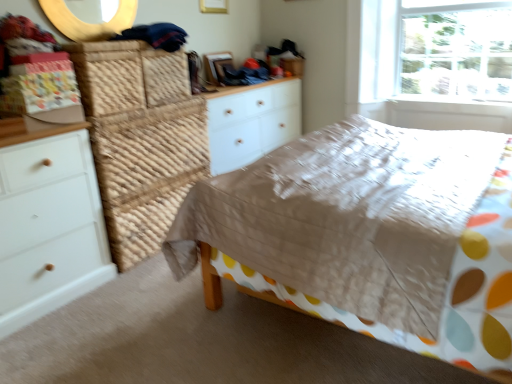
The height and width of the screenshot is (384, 512). What do you see at coordinates (371, 234) in the screenshot?
I see `matte brown bed at center` at bounding box center [371, 234].

The height and width of the screenshot is (384, 512). Identify the location of transparent glass window at upper right. (436, 49).

The width and height of the screenshot is (512, 384). I want to click on white wood chest of drawers at center, which ranks as the first chest of drawers in back-to-front order, so coord(252,123).

In order to click on matte brown bed at center in this screenshot , I will do `click(371, 234)`.

Consider the image. Is matte brown bed at center far from transparent glass window at upper right?

Absolutely, matte brown bed at center is distant from transparent glass window at upper right.

How different are the orientations of matte brown bed at center and transparent glass window at upper right in degrees?

matte brown bed at center and transparent glass window at upper right are facing 87.6 degrees away from each other.

Which object is more forward, matte brown bed at center or transparent glass window at upper right?

Positioned in front is matte brown bed at center.

Where is `bed on the left of transparent glass window at upper right`? The image size is (512, 384). bed on the left of transparent glass window at upper right is located at coordinates (371, 234).

How distant is white wood chest of drawers at left, which ranks as the first chest of drawers in front-to-back order, from matte brown bed at center?

They are 3.58 feet apart.

Is matte brown bed at center surrounded by white wood chest of drawers at left, the 1th chest of drawers positioned from the left?

That's incorrect, matte brown bed at center is not inside white wood chest of drawers at left, the 1th chest of drawers positioned from the left.

In terms of size, does white wood chest of drawers at left, arranged as the 2th chest of drawers when viewed from the right, appear bigger or smaller than matte brown bed at center?

white wood chest of drawers at left, arranged as the 2th chest of drawers when viewed from the right, is smaller than matte brown bed at center.

Is white wood chest of drawers at left, arranged as the 2th chest of drawers when viewed from the right, with matte brown bed at center?

No.

Between point (375, 58) and point (101, 26), which one is positioned behind?

The point (375, 58) is farther from the camera.

Who is shorter, transparent glass window at upper right or wooden round mirror at upper center?

With less height is wooden round mirror at upper center.

How far apart are transparent glass window at upper right and wooden round mirror at upper center?

transparent glass window at upper right is 2.25 meters from wooden round mirror at upper center.

Which object is thinner, transparent glass window at upper right or wooden round mirror at upper center?

wooden round mirror at upper center.

In the scene shown: Is transparent glass window at upper right behind white wood chest of drawers at center, which ranks as the first chest of drawers in back-to-front order?

That is True.

From a real-world perspective, is transparent glass window at upper right beneath white wood chest of drawers at center, the second chest of drawers positioned from the front?

Actually, transparent glass window at upper right is physically above white wood chest of drawers at center, the second chest of drawers positioned from the front, in the real world.

Would you say transparent glass window at upper right is to the left or to the right of white wood chest of drawers at center, the 2th chest of drawers from the left, in the picture?

Clearly, transparent glass window at upper right is on the right of white wood chest of drawers at center, the 2th chest of drawers from the left, in the image.

Is transparent glass window at upper right in contact with white wood chest of drawers at center, arranged as the 1th chest of drawers when viewed from the right?

No, transparent glass window at upper right is not making contact with white wood chest of drawers at center, arranged as the 1th chest of drawers when viewed from the right.

Does transparent glass window at upper right have a lesser height compared to matte brown bed at center?

No.

What's the angular difference between transparent glass window at upper right and matte brown bed at center's facing directions?

The angle between the facing direction of transparent glass window at upper right and the facing direction of matte brown bed at center is 87.6 degrees.

Between transparent glass window at upper right and matte brown bed at center, which one has larger width?

Wider between the two is matte brown bed at center.

From the picture: Measure the distance from wooden round mirror at upper center to white wood chest of drawers at left, arranged as the 2th chest of drawers when viewed from the right.

A distance of 3.40 feet exists between wooden round mirror at upper center and white wood chest of drawers at left, arranged as the 2th chest of drawers when viewed from the right.

Considering the positions of objects wooden round mirror at upper center and white wood chest of drawers at left, arranged as the 2th chest of drawers when viewed from the right, in the image provided, who is more to the right, wooden round mirror at upper center or white wood chest of drawers at left, arranged as the 2th chest of drawers when viewed from the right,?

From the viewer's perspective, wooden round mirror at upper center appears more on the right side.

Which of these two, wooden round mirror at upper center or white wood chest of drawers at left, the 1th chest of drawers positioned from the left, is bigger?

white wood chest of drawers at left, the 1th chest of drawers positioned from the left, is bigger.

Is point (44, 7) behind point (31, 215)?

Yes.

Is wooden round mirror at upper center not near transparent glass window at upper right?

Absolutely, wooden round mirror at upper center is distant from transparent glass window at upper right.

How many degrees apart are the facing directions of wooden round mirror at upper center and transparent glass window at upper right?

The facing directions of wooden round mirror at upper center and transparent glass window at upper right are 91.2 degrees apart.

Is wooden round mirror at upper center at the left side of transparent glass window at upper right?

Yes.

Can you confirm if wooden round mirror at upper center is wider than transparent glass window at upper right?

No.

Locate an element on the screen. Image resolution: width=512 pixels, height=384 pixels. bed that is in front of the transparent glass window at upper right is located at coordinates (371, 234).

In order to click on the chest of drawers located underneath the matte brown bed at center (from a real-world perspective) in this screenshot , I will do `click(49, 224)`.

Consider the image. Looking at the image, which one is located further to wooden round mirror at upper center, white wood chest of drawers at left, which ranks as the first chest of drawers in front-to-back order, or transparent glass window at upper right?

transparent glass window at upper right is further to wooden round mirror at upper center.

Based on their spatial positions, is transparent glass window at upper right or wooden round mirror at upper center closer to matte brown bed at center?

transparent glass window at upper right is positioned closer to the anchor matte brown bed at center.

Estimate the real-world distances between objects in this image. Which object is further from white wood chest of drawers at left, the 1th chest of drawers positioned from the left, transparent glass window at upper right or wooden round mirror at upper center?

The object further to white wood chest of drawers at left, the 1th chest of drawers positioned from the left, is transparent glass window at upper right.

When comparing their distances from transparent glass window at upper right, does matte brown bed at center or white wood chest of drawers at left, which ranks as the first chest of drawers in front-to-back order, seem further?

Among the two, white wood chest of drawers at left, which ranks as the first chest of drawers in front-to-back order, is located further to transparent glass window at upper right.

From the picture: When comparing their distances from matte brown bed at center, does white wood chest of drawers at center, arranged as the 1th chest of drawers when viewed from the right, or wooden round mirror at upper center seem further?

wooden round mirror at upper center is positioned further to the anchor matte brown bed at center.

From the image, which object appears to be farther from transparent glass window at upper right, white wood chest of drawers at center, the second chest of drawers positioned from the front, or matte brown bed at center?

matte brown bed at center is positioned further to the anchor transparent glass window at upper right.

Considering their positions, is white wood chest of drawers at center, the 2th chest of drawers from the left, positioned further to wooden round mirror at upper center than white wood chest of drawers at left, which is the second chest of drawers in back-to-front order?

white wood chest of drawers at center, the 2th chest of drawers from the left, lies further to wooden round mirror at upper center than the other object.

From the image, which object appears to be nearer to matte brown bed at center, white wood chest of drawers at center, which ranks as the first chest of drawers in back-to-front order, or white wood chest of drawers at left, arranged as the 2th chest of drawers when viewed from the right?

white wood chest of drawers at left, arranged as the 2th chest of drawers when viewed from the right, is closer to matte brown bed at center.

Find the location of a particular element. mirror located between white wood chest of drawers at left, the 1th chest of drawers positioned from the left, and transparent glass window at upper right in the left-right direction is located at coordinates (88, 23).

The height and width of the screenshot is (384, 512). What are the coordinates of `bed located between wooden round mirror at upper center and transparent glass window at upper right in the left-right direction` in the screenshot? It's located at (371, 234).

Locate an element on the screen. The height and width of the screenshot is (384, 512). the chest of drawers located between wooden round mirror at upper center and transparent glass window at upper right in the left-right direction is located at coordinates coord(252,123).

Where is `the chest of drawers located between white wood chest of drawers at left, the 1th chest of drawers positioned from the left, and matte brown bed at center in the left-right direction`? This screenshot has width=512, height=384. the chest of drawers located between white wood chest of drawers at left, the 1th chest of drawers positioned from the left, and matte brown bed at center in the left-right direction is located at coordinates (252, 123).